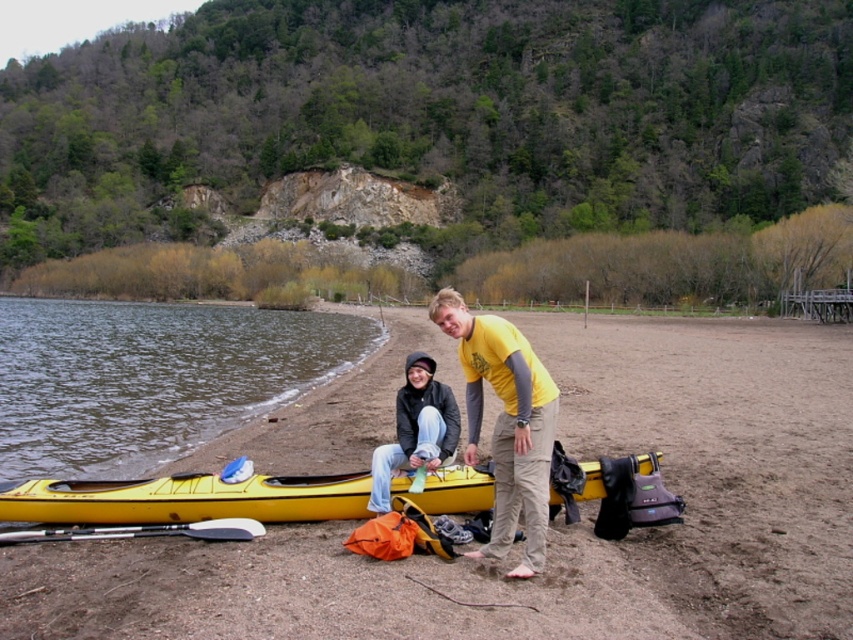
You are planning to take a short boat trip and need to know which item is closer to the left edge of the image. You see the yellow plastic water at lower left and the yellow matte kayak at lower left. Which one is positioned more to the left?

The yellow plastic water at lower left is positioned on the left side of yellow matte kayak at lower left, so it is closer to the left edge of the image.

You are a hiker who just arrived at the lakeside and need to locate the yellow plastic water at lower left. According to the scene description, where exactly should you look?

The yellow plastic water at lower left is located at point (149, 378).

You are standing at the point with coordinates (556,520) in the image. Based on the scene description, what object or feature are you likely standing on?

The brown sandy beach at lower center is located at point (556,520), so you are standing on the brown sandy beach at lower center.